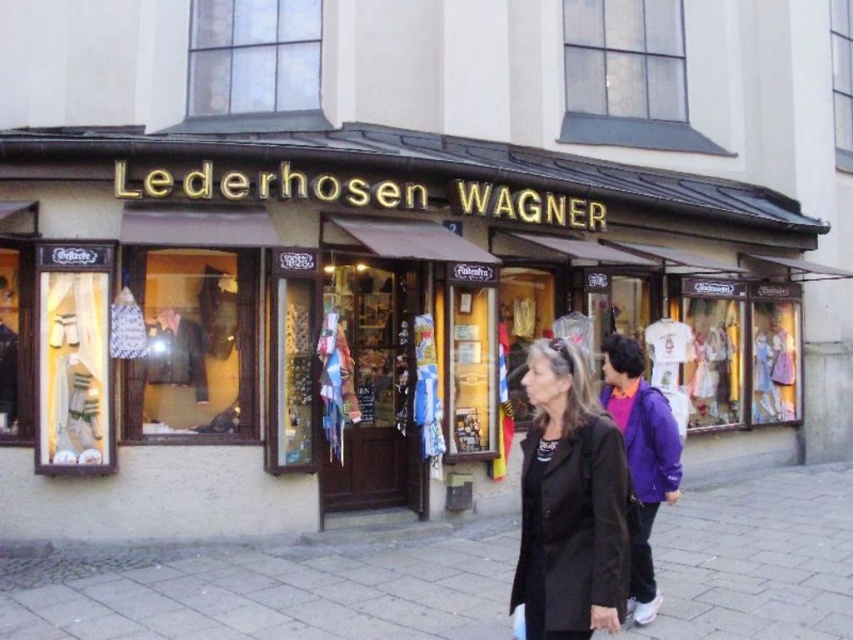
You are standing in front of the Lederhosen Wagner store. There is a point at coordinate (407, 292). What is located at this point?

The point at coordinate (407, 292) indicates a matte black sign at center.

You are a customer standing in front of the Lederhosen Wagner storefront. You see the gray stone pavement at lower center and the black leather jacket at lower right. Which object is closer to you?

The gray stone pavement at lower center is closer to you because the black leather jacket at lower right is behind it.